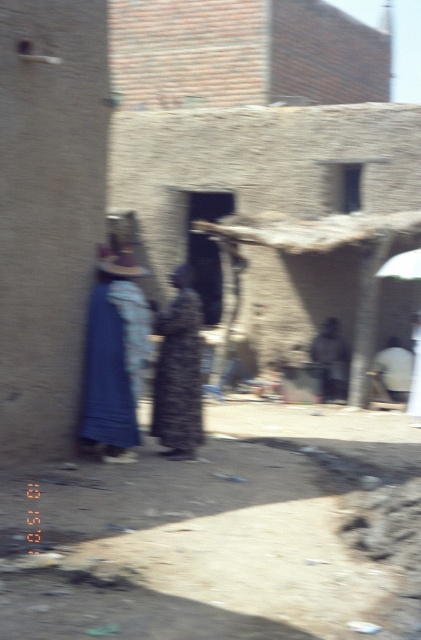
Question: Which is farther from the brown mud hut at center?

Choices:
 (A) blue fabric dress at center
 (B) printed fabric dress at center
 (C) white fabric umbrella at upper right

Answer: (A)

Question: Among these points, which one is farthest from the camera?

Choices:
 (A) (327, 596)
 (B) (400, 262)
 (C) (95, 417)
 (D) (191, 316)

Answer: (B)

Question: From the image, what is the correct spatial relationship of printed fabric dress at center in relation to white fabric umbrella at upper right?

Choices:
 (A) below
 (B) above

Answer: (A)

Question: Does brown mud hut at center appear under printed fabric dress at center?

Choices:
 (A) no
 (B) yes

Answer: (A)

Question: Is brown fabric at lower center to the right of white fabric umbrella at upper right from the viewer's perspective?

Choices:
 (A) no
 (B) yes

Answer: (A)

Question: Which point is closer to the camera taking this photo?

Choices:
 (A) (279, 182)
 (B) (109, 426)
 (C) (170, 433)

Answer: (B)